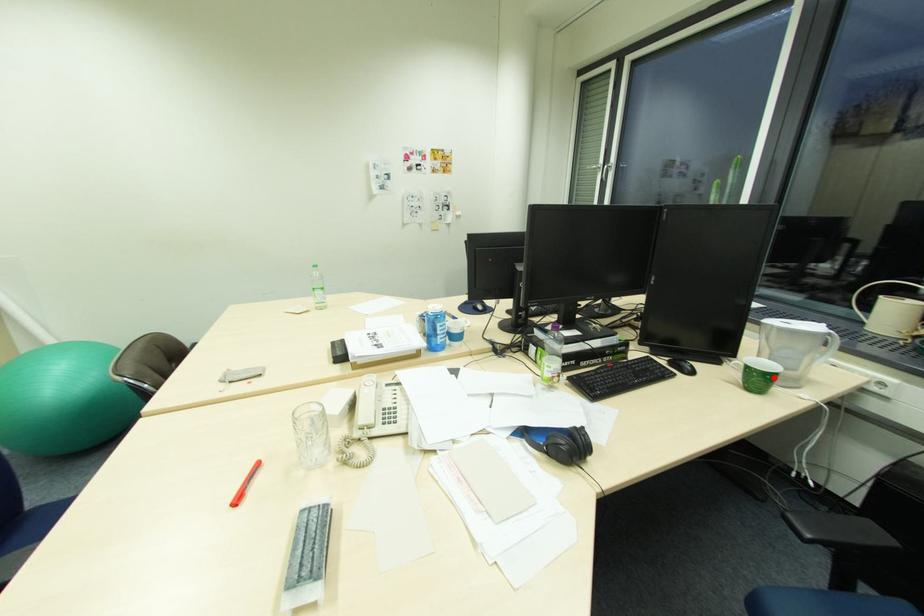
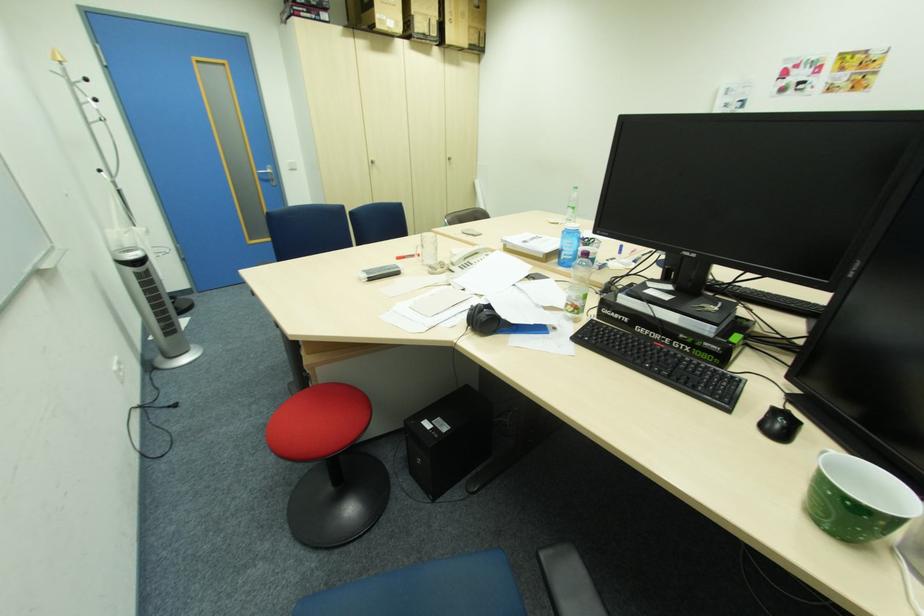
Find the pixel in the second image that matches the highlighted location in the first image.

(833, 492)